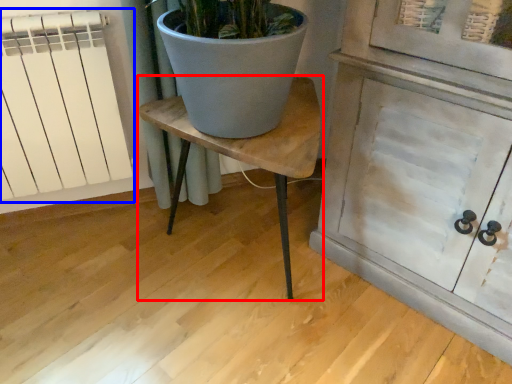
Question: Which of the following is the closest to the observer, table (highlighted by a red box) or radiator (highlighted by a blue box)?

Choices:
 (A) table
 (B) radiator

Answer: (A)